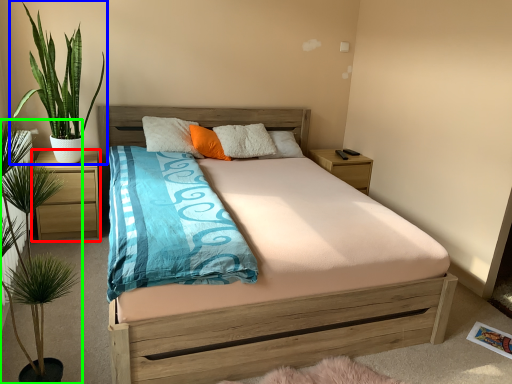
Question: Which object is the farthest from nightstand (highlighted by a red box)? Choose among these: houseplant (highlighted by a blue box) or houseplant (highlighted by a green box).

Choices:
 (A) houseplant
 (B) houseplant

Answer: (B)